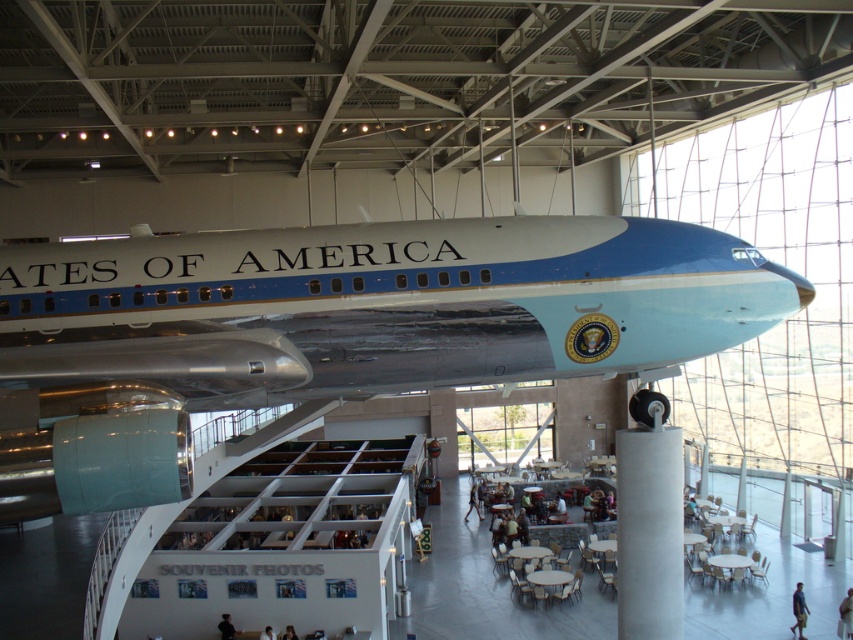
Between blue metallic airplane at center and light brown hair at lower center, which one is positioned lower?

light brown hair at lower center is below.

Is blue metallic airplane at center wider than light brown hair at lower center?

Yes.

This screenshot has width=853, height=640. Identify the location of blue metallic airplane at center. (381, 305).

Does light brown leather jacket at lower right have a smaller size compared to black fabric person at lower center?

Actually, light brown leather jacket at lower right might be larger than black fabric person at lower center.

Is point (848, 632) closer to viewer compared to point (225, 630)?

No.

Who is more distant from viewer, (846, 602) or (218, 625)?

The point (846, 602) is behind.

Find the location of a particular element. Image resolution: width=853 pixels, height=640 pixels. light brown leather jacket at lower right is located at coordinates (845, 616).

Can you confirm if light brown leather jacket at lower right is positioned to the left of light brown hair at lower center?

Incorrect, light brown leather jacket at lower right is not on the left side of light brown hair at lower center.

Is light brown leather jacket at lower right shorter than light brown hair at lower center?

Incorrect, light brown leather jacket at lower right's height does not fall short of light brown hair at lower center's.

Is point (838, 628) closer to viewer compared to point (281, 636)?

No, (838, 628) is behind (281, 636).

This screenshot has width=853, height=640. I want to click on light brown leather jacket at lower right, so click(845, 616).